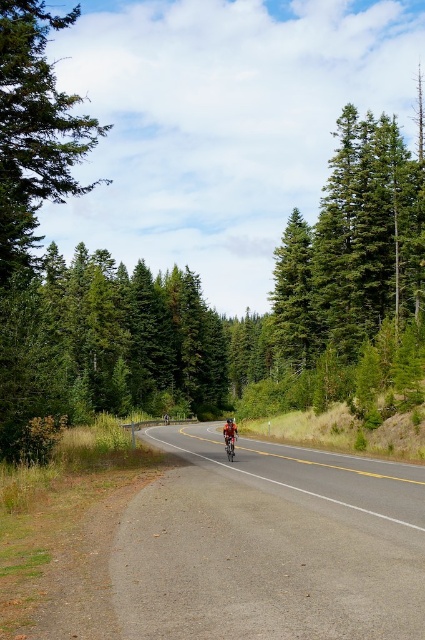
You are a photographer planning to capture a wide shot of the scenic road with both the green textured pine tree at left and the shiny red bicycle at center in the frame. Given their sizes, which object would require you to adjust your camera angle to ensure it fits entirely within the photo?

The green textured pine tree at left has a larger width than the shiny red bicycle at center, so you would need to adjust your camera angle to ensure the green textured pine tree at left fits entirely within the photo.

You are standing at the cyclist position and want to reach the point marked at coordinates. Which point, point (371, 496) or point (227, 445), is closer to you?

Point (371, 496) is closer to the viewer than point (227, 445), so the closer point is point (371, 496).

You are a drone operator trying to capture aerial footage of the cyclist. You have two points marked on your map for camera positioning. The first point is at coordinates point (62,104) and the second point is at coordinates point (231,444). Which point should you choose to ensure the camera is positioned in front of the cyclist to capture them moving towards the camera?

Point (62,104) is in front of point (231,444), so you should choose point (62,104) to position the camera in front of the cyclist to capture them moving towards the camera.